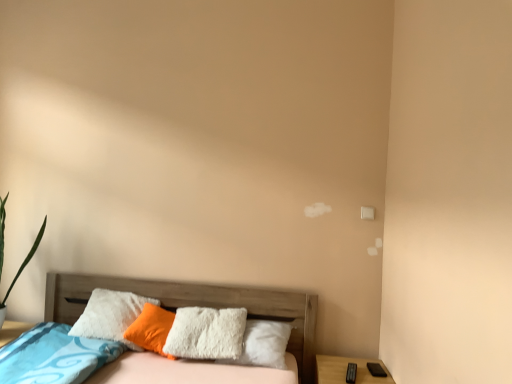
Question: From a real-world perspective, is wooden nightstand at lower right located beneath wooden bed at lower left?

Choices:
 (A) no
 (B) yes

Answer: (B)

Question: Is wooden nightstand at lower right positioned in front of wooden bed at lower left?

Choices:
 (A) no
 (B) yes

Answer: (A)

Question: Does wooden nightstand at lower right appear on the right side of wooden bed at lower left?

Choices:
 (A) no
 (B) yes

Answer: (B)

Question: From a real-world perspective, is wooden nightstand at lower right on top of wooden bed at lower left?

Choices:
 (A) yes
 (B) no

Answer: (B)

Question: Would you consider wooden nightstand at lower right to be distant from wooden bed at lower left?

Choices:
 (A) no
 (B) yes

Answer: (A)

Question: Is wooden nightstand at lower right oriented towards wooden bed at lower left?

Choices:
 (A) no
 (B) yes

Answer: (A)

Question: Is wooden nightstand at lower right surrounding white fluffy pillow at center?

Choices:
 (A) no
 (B) yes

Answer: (A)

Question: From the image's perspective, is wooden nightstand at lower right below white fluffy pillow at center?

Choices:
 (A) yes
 (B) no

Answer: (A)

Question: Considering the relative positions of wooden nightstand at lower right and white fluffy pillow at center in the image provided, is wooden nightstand at lower right behind white fluffy pillow at center?

Choices:
 (A) no
 (B) yes

Answer: (A)

Question: From a real-world perspective, is wooden nightstand at lower right physically below white fluffy pillow at center?

Choices:
 (A) no
 (B) yes

Answer: (B)

Question: Is wooden nightstand at lower right closer to camera compared to white fluffy pillow at center?

Choices:
 (A) no
 (B) yes

Answer: (B)

Question: Considering the relative positions of wooden nightstand at lower right and white fluffy pillow at center in the image provided, is wooden nightstand at lower right to the left of white fluffy pillow at center from the viewer's perspective?

Choices:
 (A) no
 (B) yes

Answer: (A)

Question: Can you confirm if white fluffy pillow at center is positioned to the right of wooden bed at lower left?

Choices:
 (A) no
 (B) yes

Answer: (A)